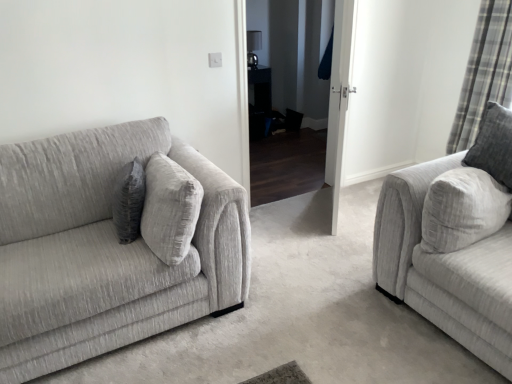
Question: Should I look upward or downward to see black glossy table at center?

Choices:
 (A) up
 (B) down

Answer: (A)

Question: From the image's perspective, is gray fabric pillow at center above textured gray couch at left, placed as the second studio couch when sorted from right to left?

Choices:
 (A) yes
 (B) no

Answer: (A)

Question: Does gray fabric pillow at center have a lesser width compared to textured gray couch at left, placed as the second studio couch when sorted from right to left?

Choices:
 (A) yes
 (B) no

Answer: (A)

Question: Would you consider gray fabric pillow at center to be distant from textured gray couch at left, placed as the second studio couch when sorted from right to left?

Choices:
 (A) yes
 (B) no

Answer: (B)

Question: Does gray fabric pillow at center come in front of textured gray couch at left, placed as the second studio couch when sorted from right to left?

Choices:
 (A) no
 (B) yes

Answer: (A)

Question: Is textured gray couch at left, placed as the second studio couch when sorted from right to left, at the back of gray fabric pillow at center?

Choices:
 (A) no
 (B) yes

Answer: (B)

Question: Can you confirm if gray fabric pillow at center is positioned to the left of textured gray couch at left, arranged as the 1th studio couch when viewed from the left?

Choices:
 (A) no
 (B) yes

Answer: (A)

Question: Does gray fabric pillow at center come in front of white glossy door at center?

Choices:
 (A) yes
 (B) no

Answer: (A)

Question: From the image's perspective, is gray fabric pillow at center on top of white glossy door at center?

Choices:
 (A) yes
 (B) no

Answer: (B)

Question: Are gray fabric pillow at center and white glossy door at center far apart?

Choices:
 (A) yes
 (B) no

Answer: (A)

Question: Is gray fabric pillow at center further to the viewer compared to white glossy door at center?

Choices:
 (A) yes
 (B) no

Answer: (B)

Question: Is the surface of gray fabric pillow at center in direct contact with white glossy door at center?

Choices:
 (A) yes
 (B) no

Answer: (B)

Question: Would you say gray fabric pillow at center contains white glossy door at center?

Choices:
 (A) no
 (B) yes

Answer: (A)

Question: Can you confirm if textured gray couch at left, placed as the second studio couch when sorted from right to left, is bigger than white glossy door at center?

Choices:
 (A) yes
 (B) no

Answer: (A)